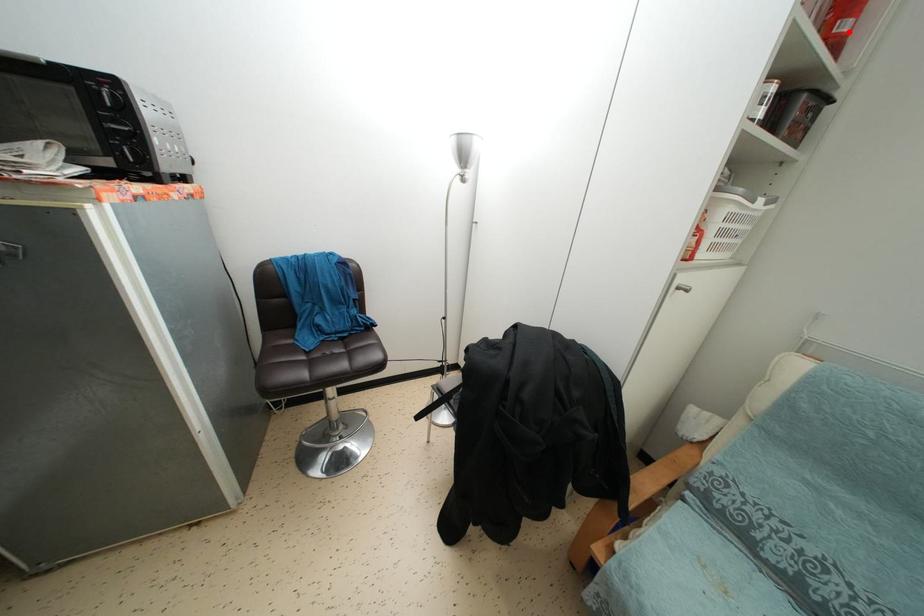
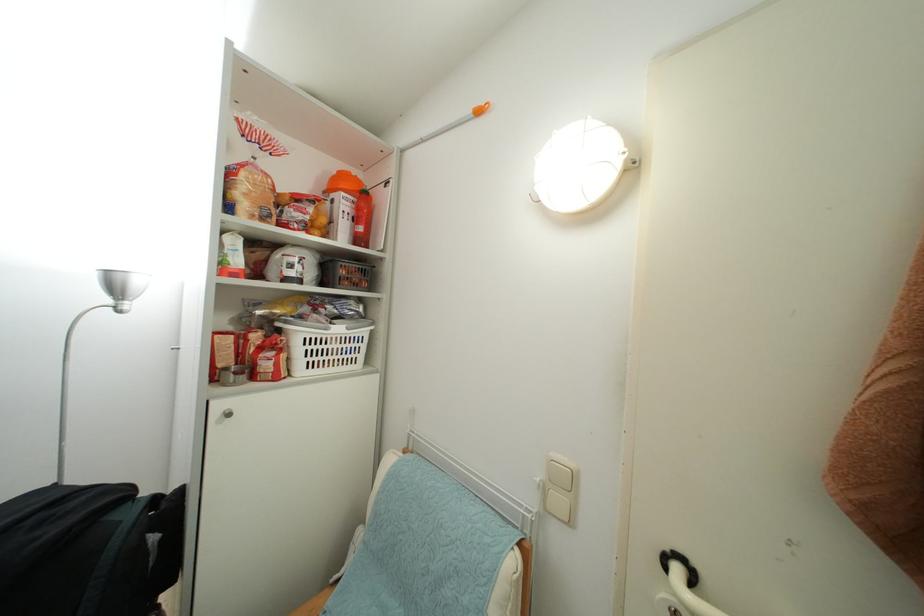
Question: I am providing you with two images of the same scene from different viewpoints. In image1, a red point is highlighted. Considering the same 3D point in image2, which of the following is correct?

Choices:
 (A) It is closer
 (B) It is farther

Answer: (A)